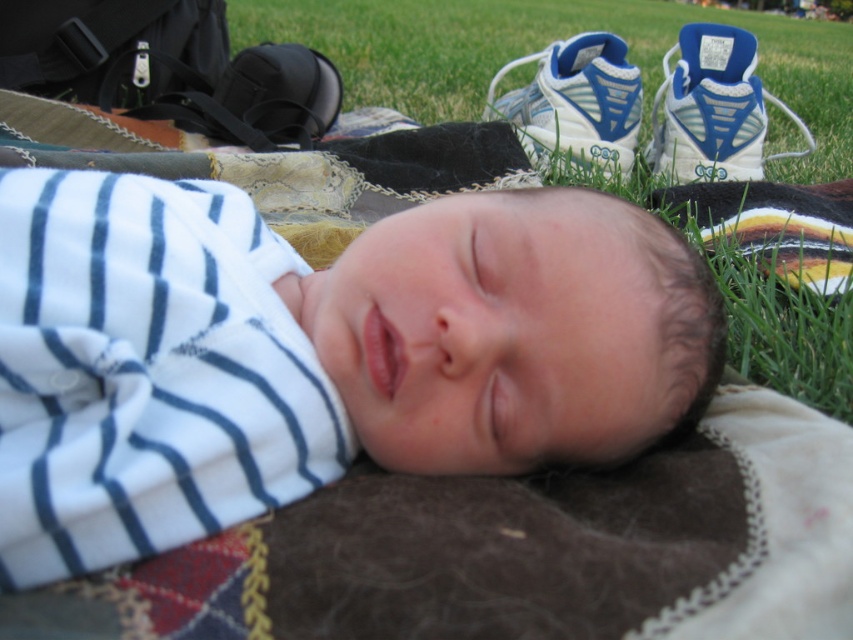
You are taking a photo of the sleeping baby and want to focus on the area between the two points, point [735,138] and point [544,132]. Which point is closer to the camera so you can adjust your focus accordingly?

Point [735,138] is closer to the camera than point [544,132], so you should focus on that point first.

Based on the scene description, where is the white soft fabric newborn at center located in terms of coordinates?

The white soft fabric newborn at center is located at coordinates point (314, 353).

You are a photographer trying to capture the sleeping baby in the center. You notice there is a point marked at coordinates (314, 353). Can you tell me what object is located at that point?

The point at coordinates (314, 353) indicates the white soft fabric newborn at center.